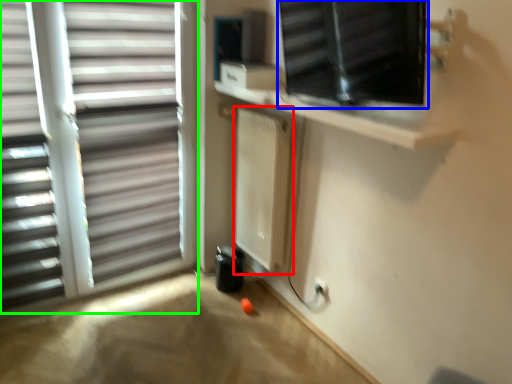
Question: Which object is the farthest from radiator (highlighted by a red box)? Choose among these: window (highlighted by a blue box) or window (highlighted by a green box).

Choices:
 (A) window
 (B) window

Answer: (A)